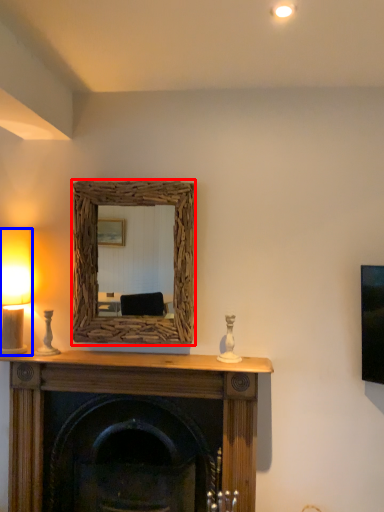
Question: Which of the following is the closest to the observer, picture frame (highlighted by a red box) or table lamp (highlighted by a blue box)?

Choices:
 (A) picture frame
 (B) table lamp

Answer: (B)